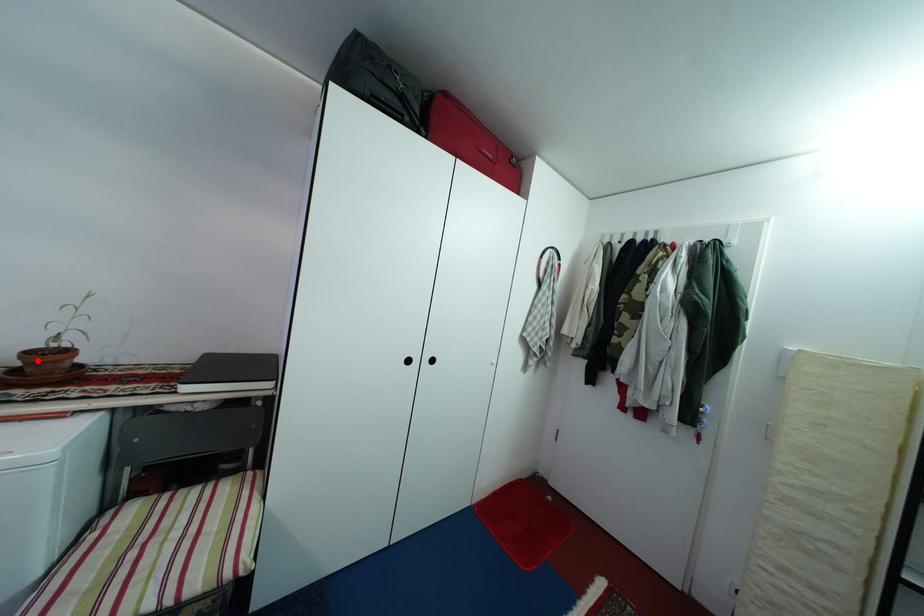
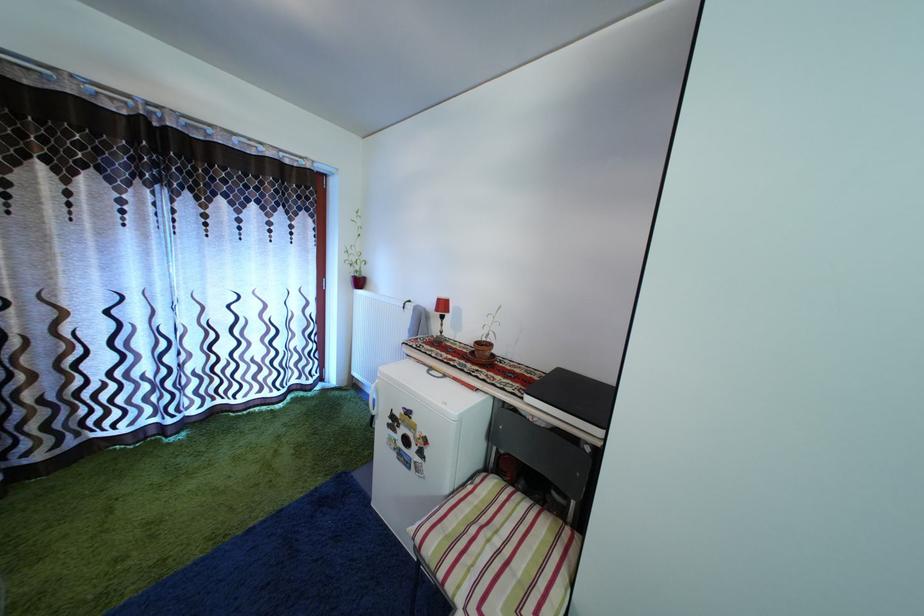
Locate, in the second image, the point that corresponds to the highlighted location in the first image.

(485, 350)